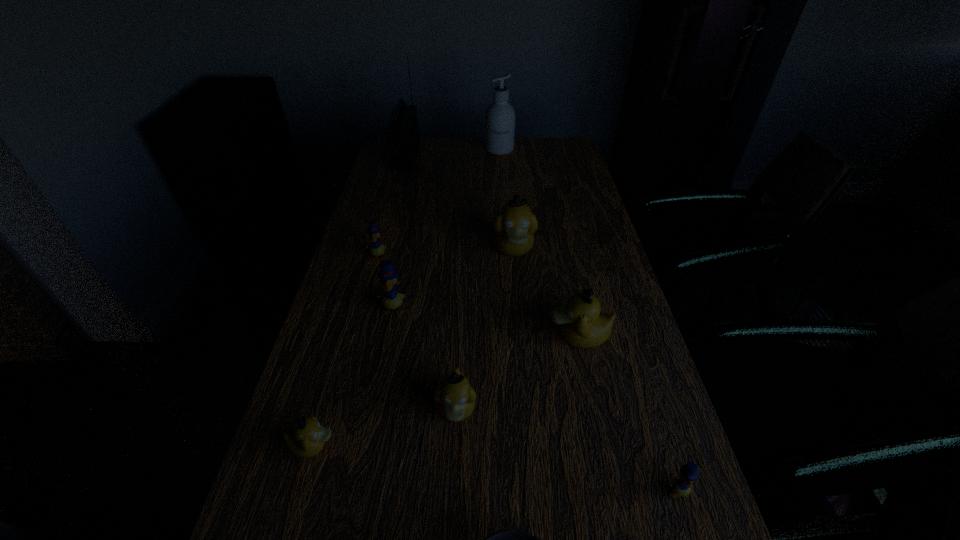
This screenshot has height=540, width=960. I want to click on radio receiver, so click(x=402, y=131).

The height and width of the screenshot is (540, 960). I want to click on cleansing agent, so click(500, 115).

This screenshot has width=960, height=540. I want to click on the biggest tan duckling, so [x=515, y=225].

I want to click on the farthest tan duckling, so click(x=515, y=225).

At what (x,y) coordinates should I click in order to perform the action: click on the sixth farthest object. Please return your answer as a coordinate pair (x, y). Looking at the image, I should click on (583, 326).

At what (x,y) coordinates should I click in order to perform the action: click on the fourth nearest duckling. Please return your answer as a coordinate pair (x, y). Looking at the image, I should click on (583, 326).

What are the coordinates of `the third duckling from left to right` in the screenshot? It's located at (391, 299).

At what (x,y) coordinates should I click in order to perform the action: click on the second yellow duckling from right to left. Please return your answer as a coordinate pair (x, y). This screenshot has height=540, width=960. Looking at the image, I should click on (391, 299).

Locate an element on the screen. The width and height of the screenshot is (960, 540). the leftmost yellow duckling is located at coordinates (376, 249).

Where is `the farthest yellow duckling`? This screenshot has width=960, height=540. the farthest yellow duckling is located at coordinates (376, 249).